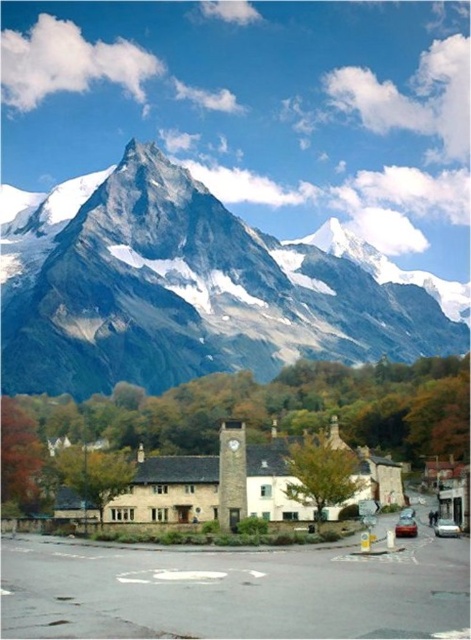
This screenshot has width=471, height=640. What do you see at coordinates (186, 291) in the screenshot?
I see `rocky gray mountain range at upper center` at bounding box center [186, 291].

Looking at this image, does rocky gray mountain range at upper center have a greater height compared to silver metallic car at center?

Indeed, rocky gray mountain range at upper center has a greater height compared to silver metallic car at center.

Between point (180, 323) and point (454, 528), which one is positioned in front?

Point (454, 528)

I want to click on rocky gray mountain range at upper center, so click(x=186, y=291).

Between silver metallic car at center and metallic red car at center, which one is positioned higher?

metallic red car at center is higher up.

Can you confirm if silver metallic car at center is shorter than metallic red car at center?

In fact, silver metallic car at center may be taller than metallic red car at center.

Does point (440, 524) come farther from viewer compared to point (403, 522)?

No, (440, 524) is in front of (403, 522).

The image size is (471, 640). I want to click on silver metallic car at center, so click(x=446, y=528).

Is smooth stone clock tower at center to the left of silver metallic car at center from the viewer's perspective?

Correct, you'll find smooth stone clock tower at center to the left of silver metallic car at center.

Describe the element at coordinates (232, 474) in the screenshot. I see `smooth stone clock tower at center` at that location.

Locate an element on the screen. smooth stone clock tower at center is located at coordinates (232, 474).